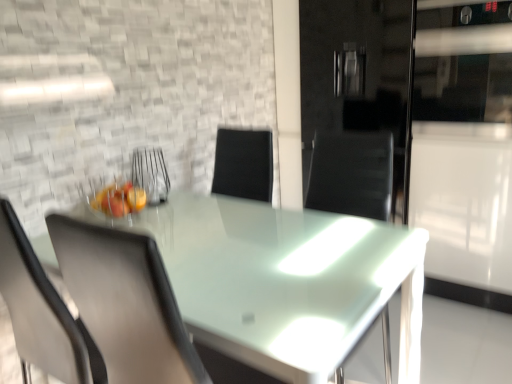
Question: Is transparent glass table at center at the left side of metallic wire basket at center?

Choices:
 (A) yes
 (B) no

Answer: (B)

Question: From a real-world perspective, is transparent glass table at center physically below metallic wire basket at center?

Choices:
 (A) yes
 (B) no

Answer: (A)

Question: From the image's perspective, would you say transparent glass table at center is positioned over metallic wire basket at center?

Choices:
 (A) no
 (B) yes

Answer: (A)

Question: Is transparent glass table at center taller than metallic wire basket at center?

Choices:
 (A) yes
 (B) no

Answer: (A)

Question: From a real-world perspective, is transparent glass table at center on metallic wire basket at center?

Choices:
 (A) no
 (B) yes

Answer: (A)

Question: Considering the relative sizes of transparent glass table at center and metallic wire basket at center in the image provided, is transparent glass table at center smaller than metallic wire basket at center?

Choices:
 (A) no
 (B) yes

Answer: (A)

Question: Considering the relative positions of transparent glass table at center and matte gray chair at left in the image provided, is transparent glass table at center to the right of matte gray chair at left from the viewer's perspective?

Choices:
 (A) no
 (B) yes

Answer: (B)

Question: Would you say matte gray chair at left is part of transparent glass table at center's contents?

Choices:
 (A) no
 (B) yes

Answer: (B)

Question: From the image's perspective, is transparent glass table at center on matte gray chair at left?

Choices:
 (A) no
 (B) yes

Answer: (A)

Question: Considering the relative sizes of transparent glass table at center and matte gray chair at left in the image provided, is transparent glass table at center taller than matte gray chair at left?

Choices:
 (A) no
 (B) yes

Answer: (A)

Question: Could you tell me if transparent glass table at center is turned towards matte gray chair at left?

Choices:
 (A) yes
 (B) no

Answer: (B)

Question: Is transparent glass table at center located outside matte gray chair at left?

Choices:
 (A) yes
 (B) no

Answer: (A)

Question: Can you confirm if matte gray chair at left is wider than transparent glass table at center?

Choices:
 (A) no
 (B) yes

Answer: (A)